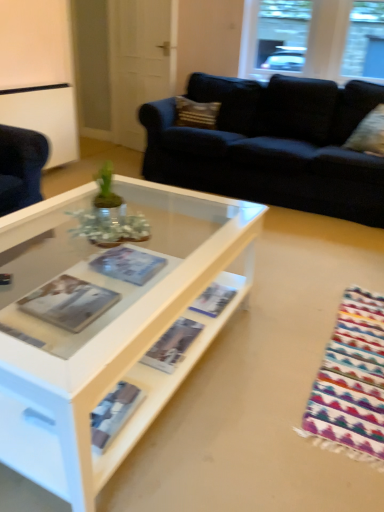
Question: Which direction should I rotate to look at matte paper magazine at center, the first magazine positioned from the right?

Choices:
 (A) right
 (B) left

Answer: (A)

Question: Does matte paper magazine at center, which is the 3th magazine from left to right, have a greater width compared to clear glass window at upper center?

Choices:
 (A) no
 (B) yes

Answer: (B)

Question: Considering the relative sizes of matte paper magazine at center, the first magazine positioned from the right, and clear glass window at upper center in the image provided, is matte paper magazine at center, the first magazine positioned from the right, bigger than clear glass window at upper center?

Choices:
 (A) yes
 (B) no

Answer: (B)

Question: From the image's perspective, is matte paper magazine at center, which is the 3th magazine from left to right, located above clear glass window at upper center?

Choices:
 (A) yes
 (B) no

Answer: (B)

Question: Is matte paper magazine at center, the first magazine positioned from the right, next to clear glass window at upper center and touching it?

Choices:
 (A) no
 (B) yes

Answer: (A)

Question: Are matte paper magazine at center, which is the 3th magazine from left to right, and clear glass window at upper center far apart?

Choices:
 (A) yes
 (B) no

Answer: (A)

Question: Can you confirm if matte paper magazine at center, which is the 3th magazine from left to right, is shorter than clear glass window at upper center?

Choices:
 (A) yes
 (B) no

Answer: (A)

Question: Does clear glass window at upper center have a greater width compared to white glossy door at upper center?

Choices:
 (A) yes
 (B) no

Answer: (A)

Question: Can you confirm if clear glass window at upper center is bigger than white glossy door at upper center?

Choices:
 (A) yes
 (B) no

Answer: (B)

Question: Considering the relative sizes of clear glass window at upper center and white glossy door at upper center in the image provided, is clear glass window at upper center smaller than white glossy door at upper center?

Choices:
 (A) no
 (B) yes

Answer: (B)

Question: From the image's perspective, is clear glass window at upper center on white glossy door at upper center?

Choices:
 (A) no
 (B) yes

Answer: (B)

Question: From a real-world perspective, is clear glass window at upper center positioned over white glossy door at upper center based on gravity?

Choices:
 (A) no
 (B) yes

Answer: (B)

Question: Is clear glass window at upper center behind white glossy door at upper center?

Choices:
 (A) yes
 (B) no

Answer: (B)

Question: From the image's perspective, is matte paper magazine at center, the 3th magazine when ordered from right to left, below textured beige pillow at upper center, which is the 2th pillow in bottom-to-top order?

Choices:
 (A) no
 (B) yes

Answer: (B)